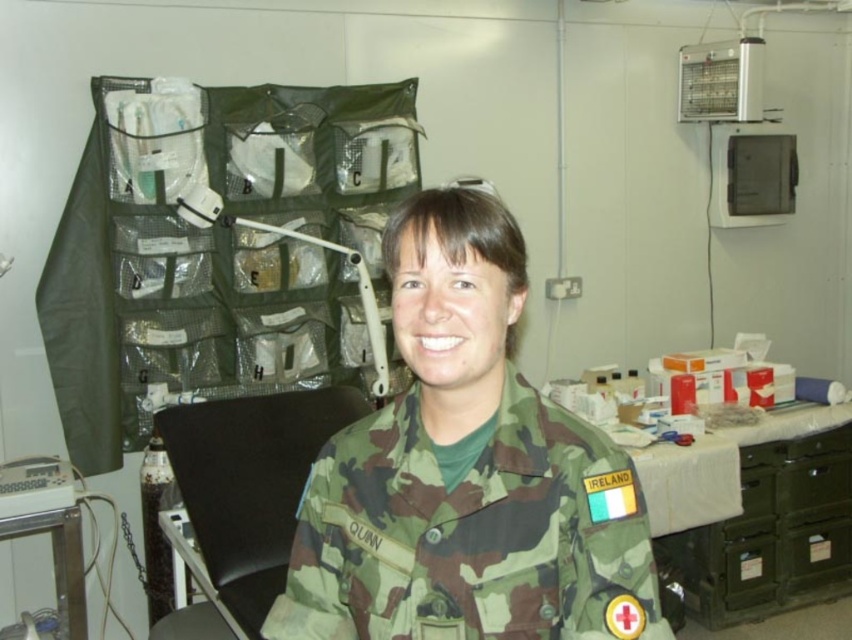
Is camo fabric uniform at center further to the viewer compared to white plastic monitor at lower left?

That is False.

Based on the photo, is camo fabric uniform at center wider than white plastic monitor at lower left?

Indeed, camo fabric uniform at center has a greater width compared to white plastic monitor at lower left.

Describe the element at coordinates (471, 532) in the screenshot. This screenshot has height=640, width=852. I see `camo fabric uniform at center` at that location.

At what (x,y) coordinates should I click in order to perform the action: click on camo fabric uniform at center. Please return your answer as a coordinate pair (x, y). Looking at the image, I should click on (471, 532).